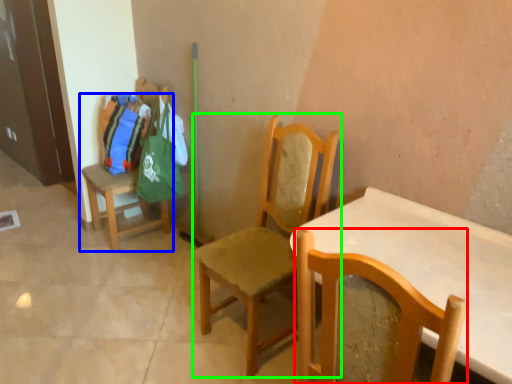
Question: Based on their relative distances, which object is farther from chair (highlighted by a red box)? Choose from chair (highlighted by a blue box) and chair (highlighted by a green box).

Choices:
 (A) chair
 (B) chair

Answer: (A)